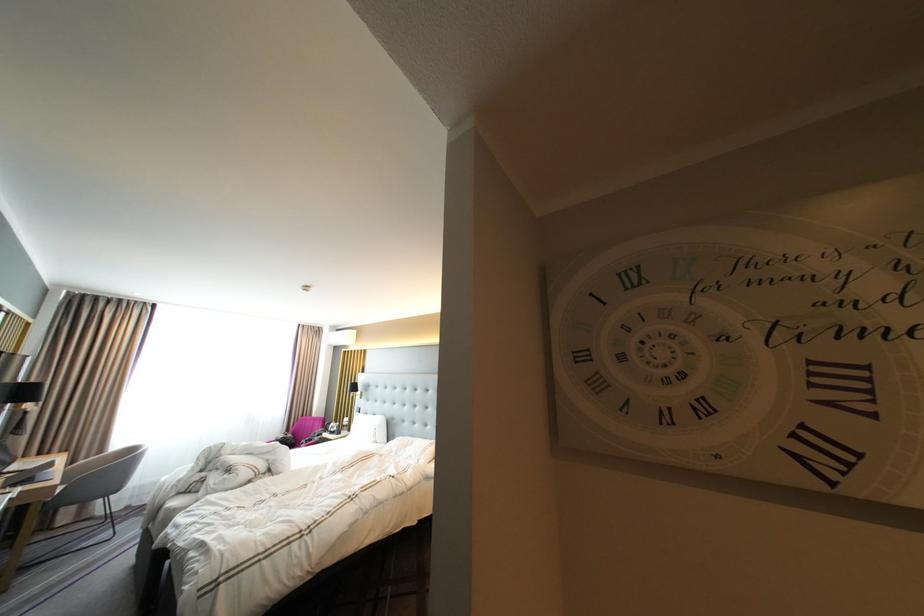
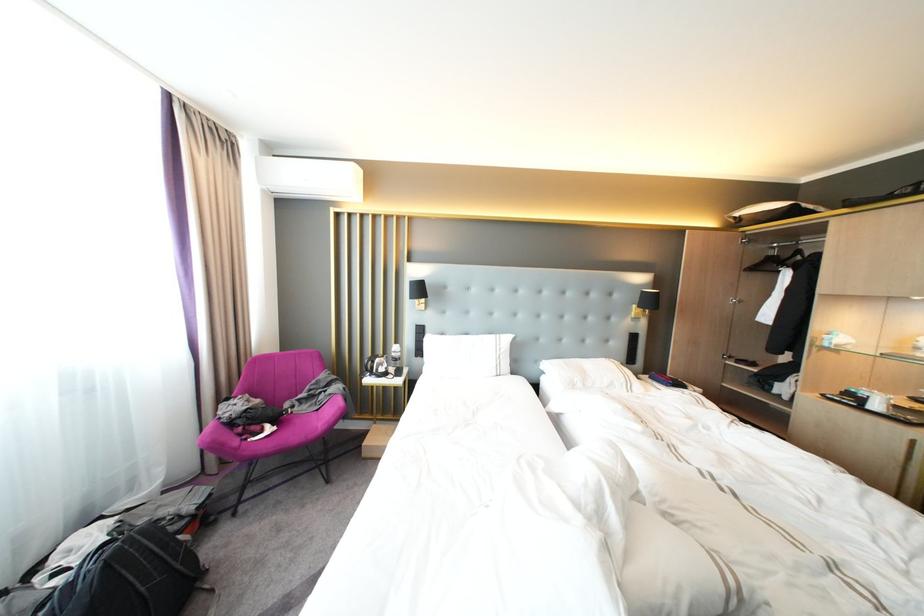
In the second image, find the point that corresponds to [379,415] in the first image.

(455, 334)